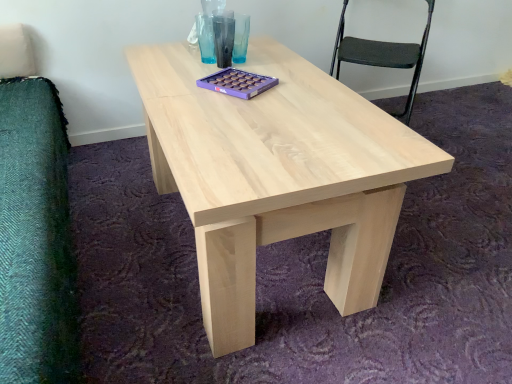
I want to click on vacant area located to the right-hand side of black fabric chair at upper right, so 445,127.